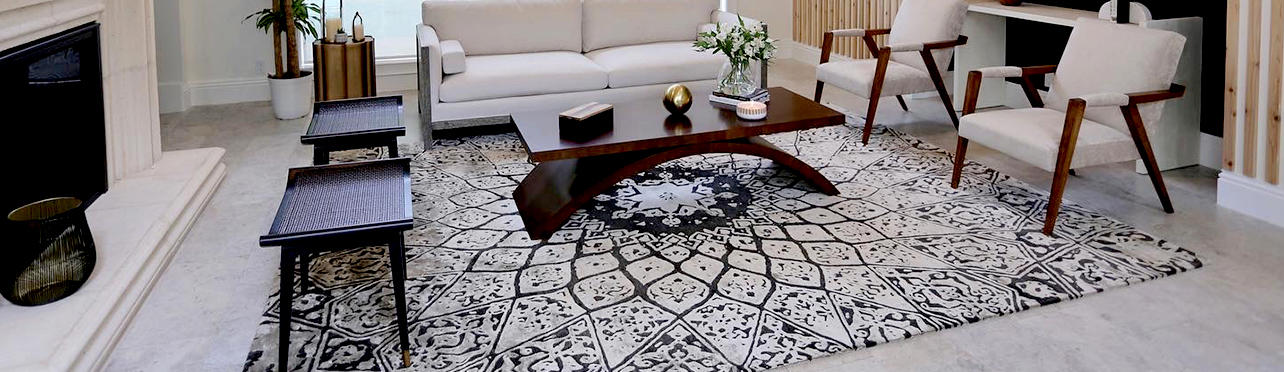
Identify the location of places to sit. (1048, 126), (859, 66), (670, 54), (497, 71), (353, 127), (333, 204), (354, 132).